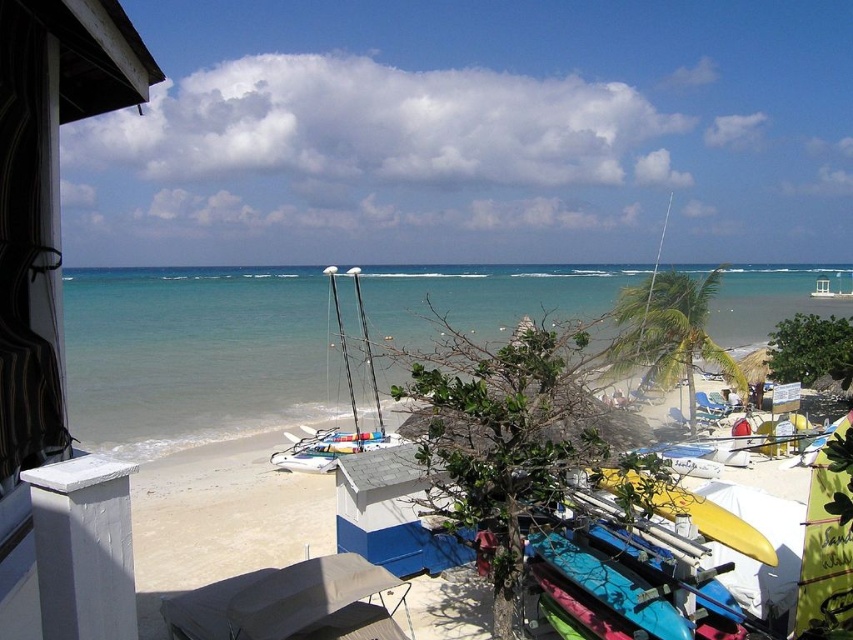
Looking at this image, can you confirm if white matte sailboat at center is bigger than yellow matte surfboard at center?

Yes, white matte sailboat at center is bigger than yellow matte surfboard at center.

Is point (294, 461) less distant than point (708, 499)?

No, it is not.

Image resolution: width=853 pixels, height=640 pixels. I want to click on white matte sailboat at center, so click(349, 404).

Is point (137, 604) more distant than point (610, 481)?

Yes, it is.

From the picture: Is yellow surfboard at center to the right of yellow matte surfboard at center from the viewer's perspective?

Incorrect, yellow surfboard at center is not on the right side of yellow matte surfboard at center.

Locate an element on the screen. yellow surfboard at center is located at coordinates (221, 518).

Image resolution: width=853 pixels, height=640 pixels. In order to click on yellow surfboard at center in this screenshot , I will do `click(221, 518)`.

Based on the photo, who is taller, yellow surfboard at center or white matte sailboat at center?

white matte sailboat at center

Between point (434, 634) and point (361, 307), which one is positioned in front?

Point (434, 634) is more forward.

Where is `yellow surfboard at center`? yellow surfboard at center is located at coordinates (221, 518).